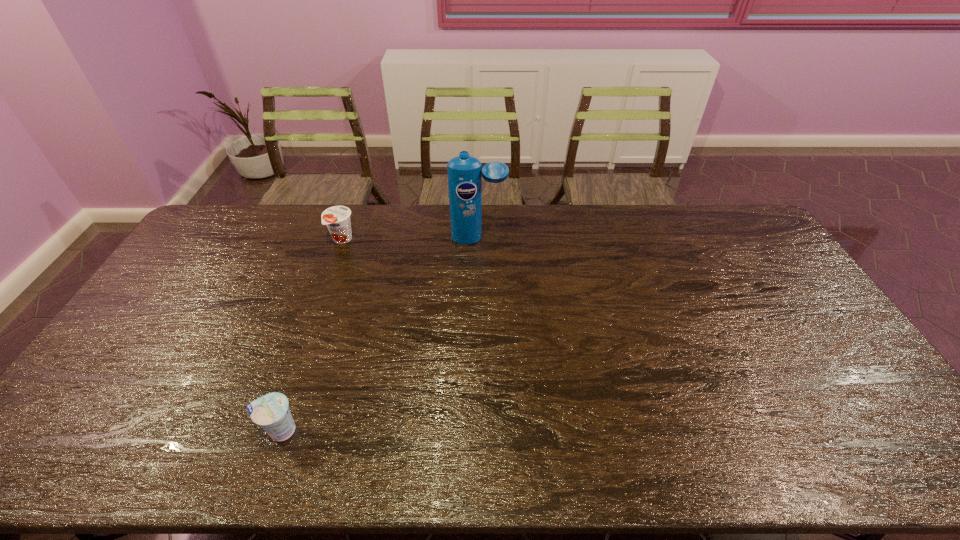
Where is `vacant space at the far edge of the desktop`? The height and width of the screenshot is (540, 960). vacant space at the far edge of the desktop is located at coordinates (261, 233).

Image resolution: width=960 pixels, height=540 pixels. Find the location of `free space at the near edge`. free space at the near edge is located at coordinates (275, 462).

In the image, there is a desktop. Where is `blank space at the left edge`? The height and width of the screenshot is (540, 960). blank space at the left edge is located at coordinates (179, 326).

The image size is (960, 540). Find the location of `vacant space at the right edge of the desktop`. vacant space at the right edge of the desktop is located at coordinates (812, 325).

In the image, there is a desktop. Where is `free region at the far left corner`? The width and height of the screenshot is (960, 540). free region at the far left corner is located at coordinates (228, 205).

Locate an element on the screen. free spot between the shampoo and the farther yogurt is located at coordinates (410, 239).

Where is `free spot between the farther yogurt and the shampoo`? free spot between the farther yogurt and the shampoo is located at coordinates (410, 239).

Where is `vacant region between the farther yogurt and the tallest object`? The height and width of the screenshot is (540, 960). vacant region between the farther yogurt and the tallest object is located at coordinates (410, 239).

Locate an element on the screen. free space that is in between the tallest object and the farther yogurt is located at coordinates (410, 239).

Where is `empty location between the farther yogurt and the nearer yogurt`? This screenshot has width=960, height=540. empty location between the farther yogurt and the nearer yogurt is located at coordinates (311, 335).